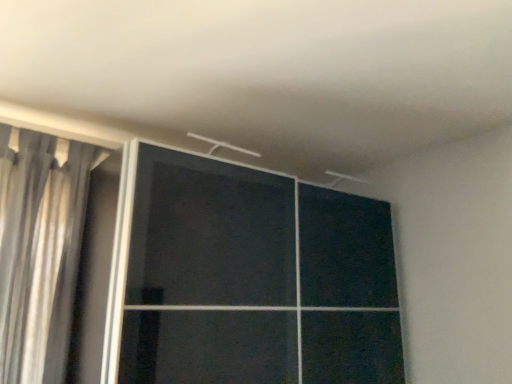
The height and width of the screenshot is (384, 512). What do you see at coordinates (39, 250) in the screenshot?
I see `silky gray curtain at left` at bounding box center [39, 250].

At what (x,y) coordinates should I click in order to perform the action: click on silky gray curtain at left. Please return your answer as a coordinate pair (x, y). Image resolution: width=512 pixels, height=384 pixels. Looking at the image, I should click on (39, 250).

This screenshot has width=512, height=384. I want to click on transparent glass door at center, so click(x=250, y=278).

Image resolution: width=512 pixels, height=384 pixels. What do you see at coordinates (250, 278) in the screenshot? I see `transparent glass door at center` at bounding box center [250, 278].

I want to click on silky gray curtain at left, so click(39, 250).

Which object is positioned more to the right, silky gray curtain at left or transparent glass door at center?

transparent glass door at center.

Is silky gray curtain at left further to the viewer compared to transparent glass door at center?

That is True.

Which is behind, point (16, 191) or point (248, 267)?

The point (248, 267) is farther.

From the image's perspective, who appears lower, silky gray curtain at left or transparent glass door at center?

transparent glass door at center.

From a real-world perspective, is silky gray curtain at left positioned over transparent glass door at center based on gravity?

Indeed, from a real-world perspective, silky gray curtain at left stands above transparent glass door at center.

Is silky gray curtain at left wider than transparent glass door at center?

No.

In terms of height, does silky gray curtain at left look taller or shorter compared to transparent glass door at center?

In the image, silky gray curtain at left appears to be shorter than transparent glass door at center.

Does silky gray curtain at left have a smaller size compared to transparent glass door at center?

Correct, silky gray curtain at left occupies less space than transparent glass door at center.

Is transparent glass door at center inside silky gray curtain at left?

No, transparent glass door at center is not surrounded by silky gray curtain at left.

Does silky gray curtain at left touch transparent glass door at center?

No.

Is silky gray curtain at left positioned with its back to transparent glass door at center?

No, transparent glass door at center is not at the back of silky gray curtain at left.

I want to click on door on the right of silky gray curtain at left, so click(250, 278).

Which object is positioned more to the right, transparent glass door at center or silky gray curtain at left?

transparent glass door at center.

Considering the relative positions of transparent glass door at center and silky gray curtain at left in the image provided, is transparent glass door at center in front of silky gray curtain at left?

Yes, the depth of transparent glass door at center is less than that of silky gray curtain at left.

Which is closer, (268,202) or (8,248)?

Point (268,202) is farther from the camera than point (8,248).

From the image's perspective, is transparent glass door at center located above or below silky gray curtain at left?

Clearly, from the image's perspective, transparent glass door at center is below silky gray curtain at left.

From a real-world perspective, between transparent glass door at center and silky gray curtain at left, who is vertically higher?

silky gray curtain at left.

Can you confirm if transparent glass door at center is thinner than silky gray curtain at left?

Incorrect, the width of transparent glass door at center is not less than that of silky gray curtain at left.

Considering the relative sizes of transparent glass door at center and silky gray curtain at left in the image provided, is transparent glass door at center taller than silky gray curtain at left?

Correct, transparent glass door at center is much taller as silky gray curtain at left.

Based on their sizes in the image, would you say transparent glass door at center is bigger or smaller than silky gray curtain at left?

Clearly, transparent glass door at center is larger in size than silky gray curtain at left.

Is silky gray curtain at left surrounded by transparent glass door at center?

No, transparent glass door at center does not contain silky gray curtain at left.

Does transparent glass door at center touch silky gray curtain at left?

No, transparent glass door at center is not beside silky gray curtain at left.

Is transparent glass door at center aimed at silky gray curtain at left?

No, transparent glass door at center is not aimed at silky gray curtain at left.

How different are the orientations of transparent glass door at center and silky gray curtain at left in degrees?

1.02 degrees.

Locate an element on the screen. The width and height of the screenshot is (512, 384). door lying in front of the silky gray curtain at left is located at coordinates (250, 278).

Where is `door in front of the silky gray curtain at left`? This screenshot has width=512, height=384. door in front of the silky gray curtain at left is located at coordinates (250, 278).

The height and width of the screenshot is (384, 512). I want to click on curtain behind the transparent glass door at center, so click(x=39, y=250).